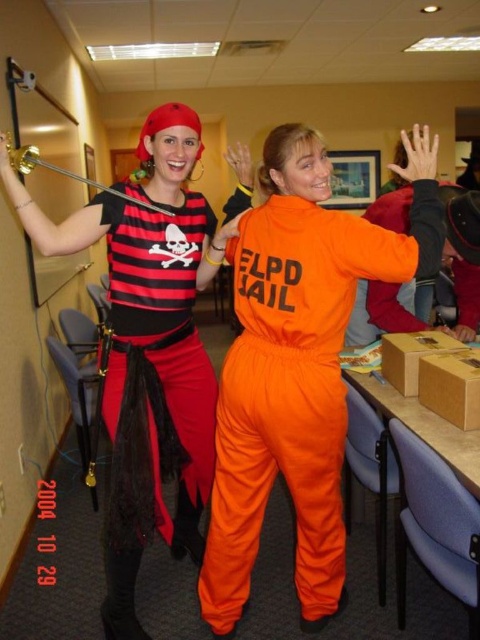
Question: Estimate the real-world distances between objects in this image. Which object is closer to the orange matte jumpsuit at center?

Choices:
 (A) matte black pirate costume at left
 (B) matte black pirate vest at left

Answer: (B)

Question: Is orange matte jumpsuit at center bigger than matte black pirate vest at left?

Choices:
 (A) yes
 (B) no

Answer: (A)

Question: Which object is closer to the camera taking this photo?

Choices:
 (A) matte black pirate costume at left
 (B) matte black pirate vest at left

Answer: (A)

Question: In this image, where is matte black pirate costume at left located relative to matte black pirate vest at left?

Choices:
 (A) right
 (B) left

Answer: (B)

Question: Does matte black pirate costume at left appear under matte black pirate vest at left?

Choices:
 (A) no
 (B) yes

Answer: (A)

Question: Estimate the real-world distances between objects in this image. Which object is closer to the matte black pirate vest at left?

Choices:
 (A) orange matte jumpsuit at center
 (B) matte black pirate costume at left

Answer: (B)